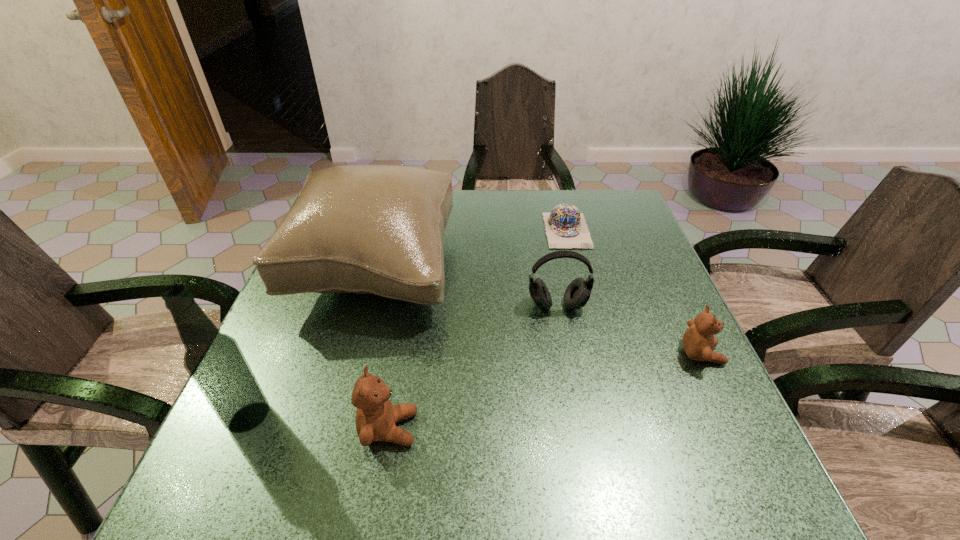
Image resolution: width=960 pixels, height=540 pixels. Find the location of `cap that is positioned at the right edge`. cap that is positioned at the right edge is located at coordinates (566, 227).

Where is `object at the far left corner`? The width and height of the screenshot is (960, 540). object at the far left corner is located at coordinates (365, 229).

At what (x,y) coordinates should I click in order to perform the action: click on object that is at the near left corner. Please return your answer as a coordinate pair (x, y). The image size is (960, 540). Looking at the image, I should click on 215,362.

You are a GUI agent. You are given a task and a screenshot of the screen. Output one action in this format:
    pyautogui.click(x=<x>, y=<y>)
    Task: Click on the object that is positioned at the far right corner
    This screenshot has height=540, width=960.
    Given the screenshot: What is the action you would take?
    pyautogui.click(x=566, y=227)

You are a GUI agent. You are given a task and a screenshot of the screen. Output one action in this format:
    pyautogui.click(x=<x>, y=<y>)
    Task: Click on the vacant space at the far edge of the desktop
    Image resolution: width=960 pixels, height=540 pixels.
    Given the screenshot: What is the action you would take?
    pyautogui.click(x=460, y=206)

Image resolution: width=960 pixels, height=540 pixels. What are the coordinates of `vacant space at the near edge of the desktop` in the screenshot? It's located at (517, 426).

You are a GUI agent. You are given a task and a screenshot of the screen. Output one action in this format:
    pyautogui.click(x=<x>, y=<y>)
    Task: Click on the blank space at the left edge of the desktop
    This screenshot has width=960, height=540.
    Given the screenshot: What is the action you would take?
    pyautogui.click(x=331, y=332)

You are a GUI agent. You are given a task and a screenshot of the screen. Output one action in this format:
    pyautogui.click(x=<x>, y=<y>)
    Task: Click on the blank space at the right edge of the desktop
    
    Given the screenshot: What is the action you would take?
    pyautogui.click(x=636, y=353)

Where is `vacant space at the near left corner`? vacant space at the near left corner is located at coordinates (308, 418).

Identify the location of vacant point located between the alcohol and the shorter teddy bear. The height and width of the screenshot is (540, 960). (475, 386).